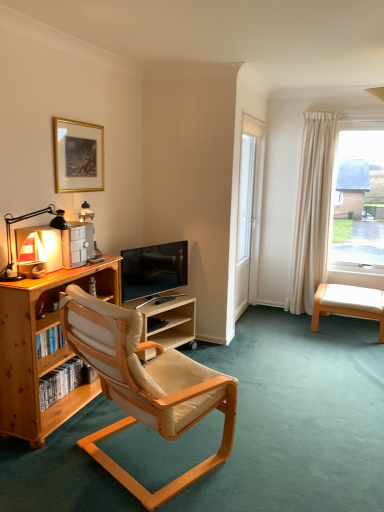
The height and width of the screenshot is (512, 384). Find the location of `vacant space positioned to the left of beige leather swivel chair at lower right`. vacant space positioned to the left of beige leather swivel chair at lower right is located at coordinates (295, 328).